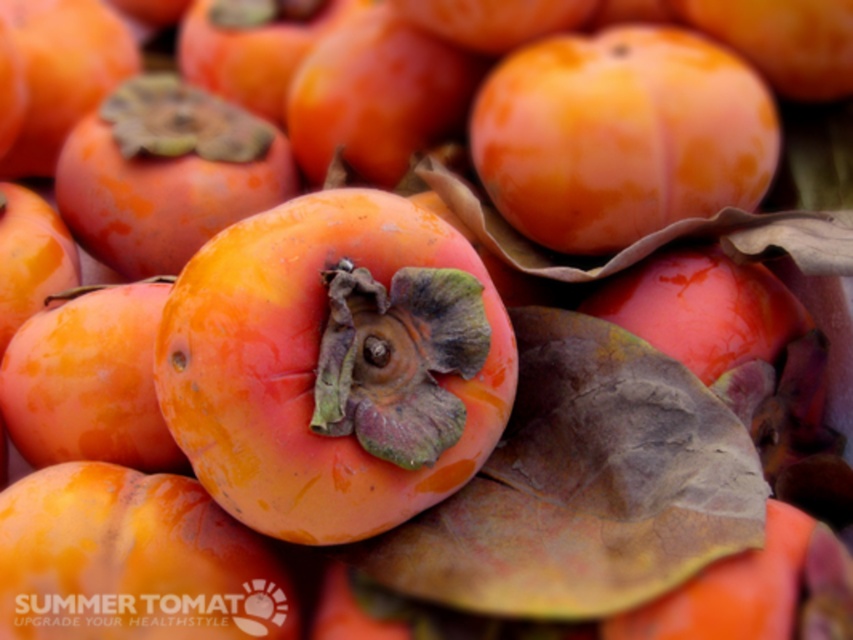
Question: Can you confirm if glossy orange persimmon at center is smaller than matte orange apricot at center?

Choices:
 (A) no
 (B) yes

Answer: (B)

Question: Which object appears farthest from the camera in this image?

Choices:
 (A) glossy orange persimmon at center
 (B) matte orange apricot at center

Answer: (B)

Question: Where is glossy orange persimmon at center located in relation to matte orange apricot at center in the image?

Choices:
 (A) left
 (B) right

Answer: (A)

Question: Which object appears closest to the camera in this image?

Choices:
 (A) matte orange apricot at center
 (B) glossy orange persimmon at center

Answer: (B)

Question: Which point is farther to the camera?

Choices:
 (A) glossy orange persimmon at center
 (B) matte orange apricot at center

Answer: (B)

Question: Is glossy orange persimmon at center smaller than matte orange apricot at center?

Choices:
 (A) yes
 (B) no

Answer: (A)